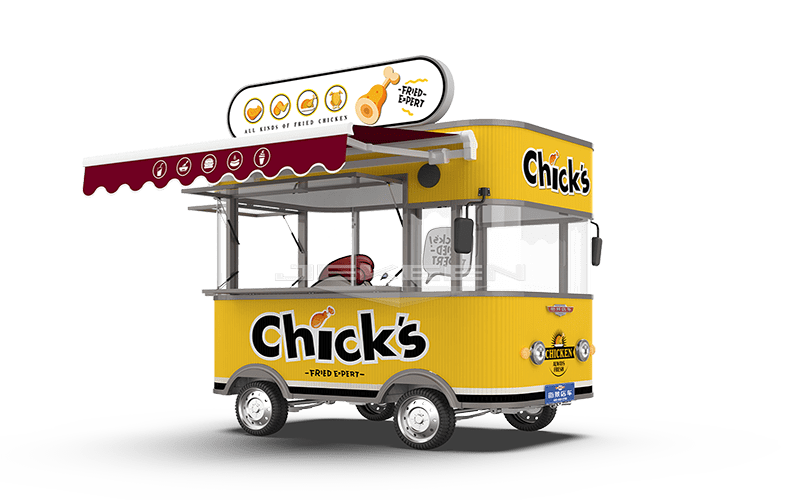
Where is `lights`? The image size is (800, 500). lights is located at coordinates (542, 347).